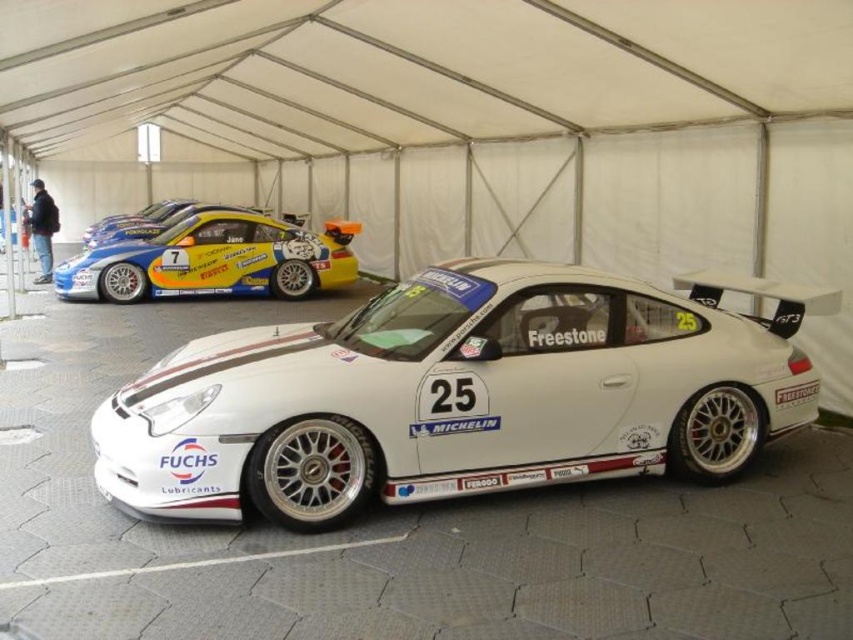
Does white matte race car at center have a greater width compared to yellow/golden metallic race car at upper left?

Indeed, white matte race car at center has a greater width compared to yellow/golden metallic race car at upper left.

Can you confirm if white matte race car at center is positioned below yellow/golden metallic race car at upper left?

Yes, white matte race car at center is below yellow/golden metallic race car at upper left.

Describe the element at coordinates (456, 396) in the screenshot. This screenshot has width=853, height=640. I see `white matte race car at center` at that location.

This screenshot has width=853, height=640. In order to click on white matte race car at center in this screenshot , I will do `click(456, 396)`.